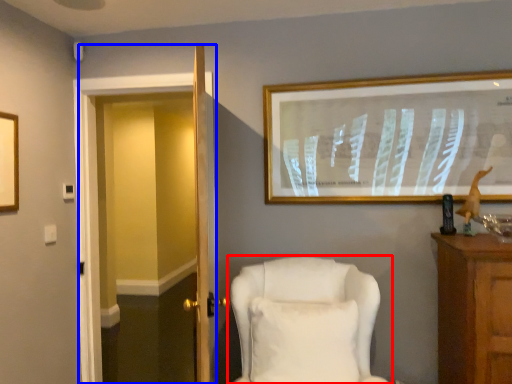
Question: Which object appears farthest to the camera in this image, chair (highlighted by a red box) or glass door (highlighted by a blue box)?

Choices:
 (A) chair
 (B) glass door

Answer: (B)